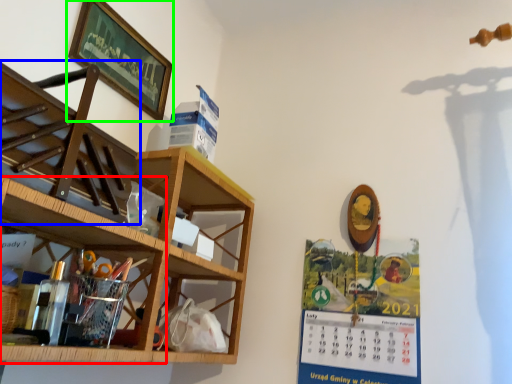
Question: Based on their relative distances, which object is nearer to shelf (highlighted by a red box)? Choose from shelf (highlighted by a blue box) and picture frame (highlighted by a green box).

Choices:
 (A) shelf
 (B) picture frame

Answer: (A)